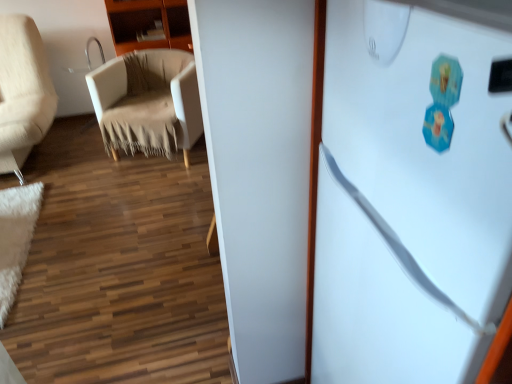
Question: Is white fluffy mat at lower left inside or outside of wooden cabinet at upper left?

Choices:
 (A) outside
 (B) inside

Answer: (A)

Question: Considering the relative positions of white fluffy mat at lower left and wooden cabinet at upper left in the image provided, is white fluffy mat at lower left to the left or to the right of wooden cabinet at upper left?

Choices:
 (A) left
 (B) right

Answer: (A)

Question: Estimate the real-world distances between objects in this image. Which object is farther from the beige fabric chair at left?

Choices:
 (A) white fluffy mat at lower left
 (B) white matte refrigerator at right
 (C) wooden cabinet at upper left

Answer: (B)

Question: Which object is the closest to the white fluffy mat at lower left?

Choices:
 (A) beige fabric chair at left
 (B) white matte refrigerator at right
 (C) wooden cabinet at upper left

Answer: (A)